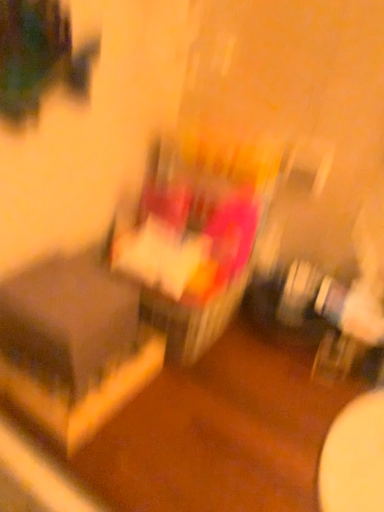
This screenshot has width=384, height=512. In order to click on matte black table at left in this screenshot , I will do `click(66, 321)`.

This screenshot has width=384, height=512. What do you see at coordinates (66, 321) in the screenshot?
I see `matte black table at left` at bounding box center [66, 321].

I want to click on matte black table at left, so coord(66,321).